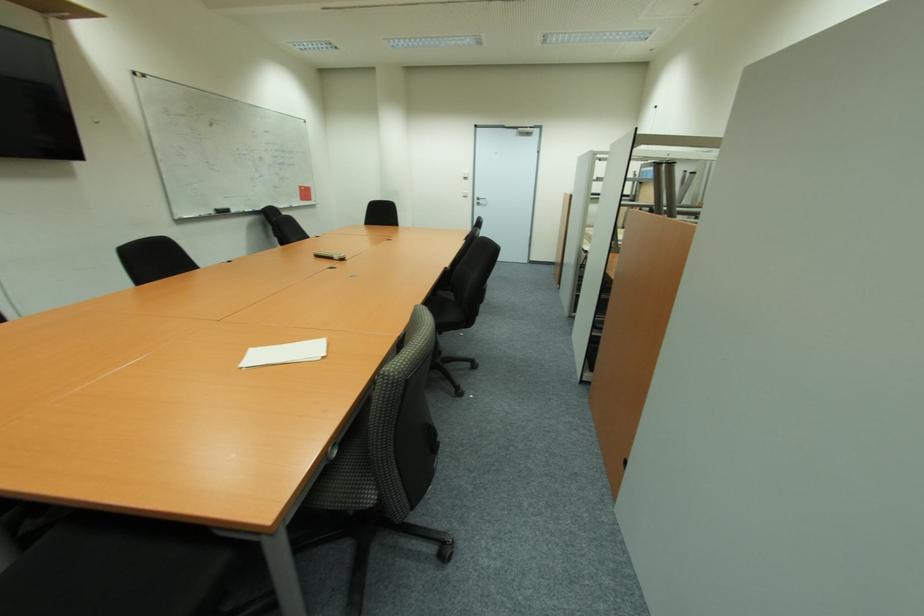
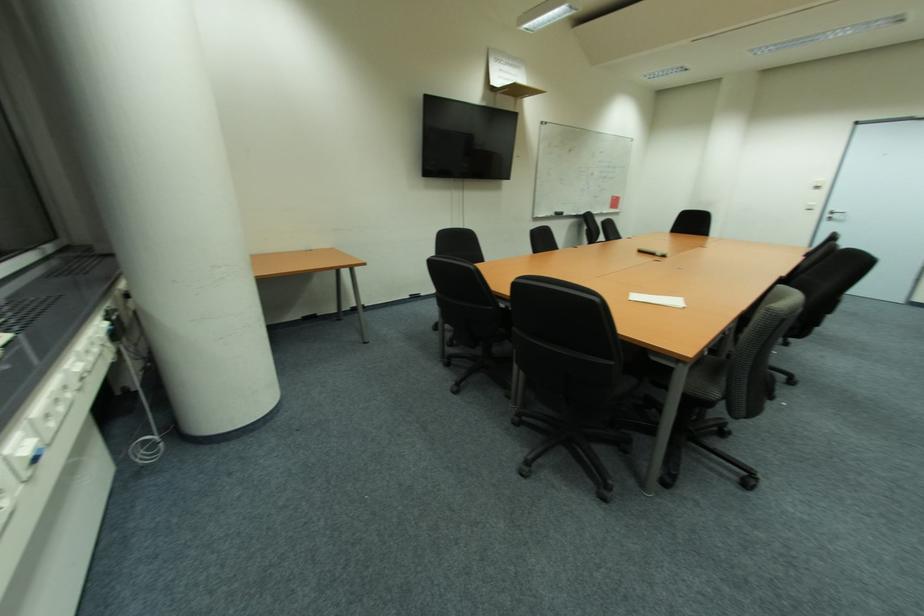
The point at (483, 203) is marked in the first image. Where is the corresponding point in the second image?

(842, 217)